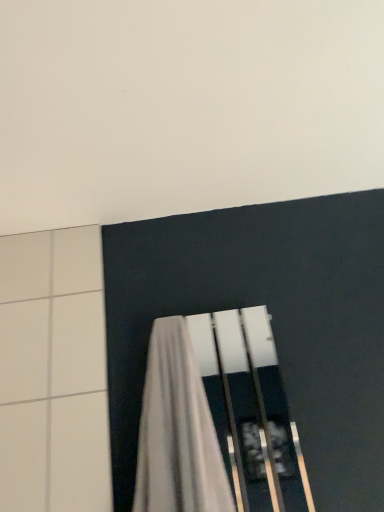
Question: Considering the positions of white matte wall at upper center and white fabric curtain at lower center in the image, is white matte wall at upper center taller or shorter than white fabric curtain at lower center?

Choices:
 (A) tall
 (B) short

Answer: (B)

Question: Based on their positions, is white matte wall at upper center located to the left or right of white fabric curtain at lower center?

Choices:
 (A) right
 (B) left

Answer: (A)

Question: Which is correct: white matte wall at upper center is inside white fabric curtain at lower center, or outside of it?

Choices:
 (A) outside
 (B) inside

Answer: (A)

Question: Does point (228, 483) appear closer or farther from the camera than point (354, 36)?

Choices:
 (A) closer
 (B) farther

Answer: (B)

Question: Is white fabric curtain at lower center bigger or smaller than white matte wall at upper center?

Choices:
 (A) small
 (B) big

Answer: (B)

Question: From the image's perspective, is white fabric curtain at lower center located above or below white matte wall at upper center?

Choices:
 (A) above
 (B) below

Answer: (B)

Question: In terms of height, does white fabric curtain at lower center look taller or shorter compared to white matte wall at upper center?

Choices:
 (A) short
 (B) tall

Answer: (B)